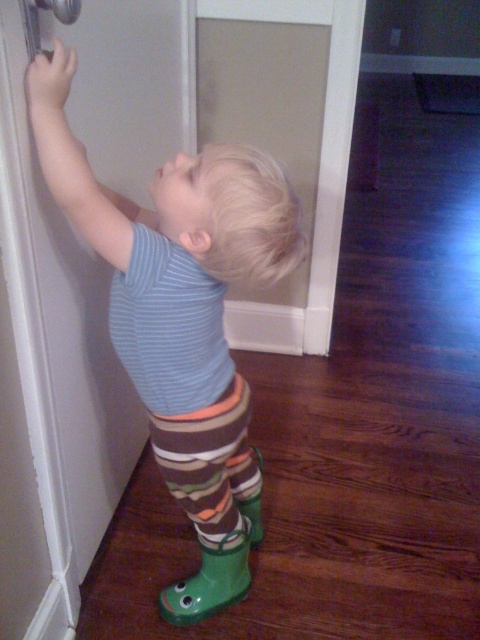
Which of these two, green rubber boot at lower right or metallic silver door handle at upper left, stands shorter?

metallic silver door handle at upper left

Between point (239, 541) and point (69, 12), which one is positioned in front?

Point (69, 12) is more forward.

Is point (178, 588) positioned in front of point (34, 35)?

No.

At what (x,y) coordinates should I click in order to perform the action: click on green rubber boot at lower right. Please return your answer as a coordinate pair (x, y). The width and height of the screenshot is (480, 640). Looking at the image, I should click on (211, 579).

Does green rubber boots at lower left appear on the left side of metallic silver door handle at upper left?

No, green rubber boots at lower left is not to the left of metallic silver door handle at upper left.

Where is `green rubber boots at lower left`? The height and width of the screenshot is (640, 480). green rubber boots at lower left is located at coordinates (180, 316).

The height and width of the screenshot is (640, 480). Describe the element at coordinates (180, 316) in the screenshot. I see `green rubber boots at lower left` at that location.

Find the location of `green rubber boots at lower left`. green rubber boots at lower left is located at coordinates (180, 316).

Which is more to the left, green rubber boots at lower left or green rubber boot at lower right?

Positioned to the left is green rubber boot at lower right.

Where is `green rubber boots at lower left`? The image size is (480, 640). green rubber boots at lower left is located at coordinates (180, 316).